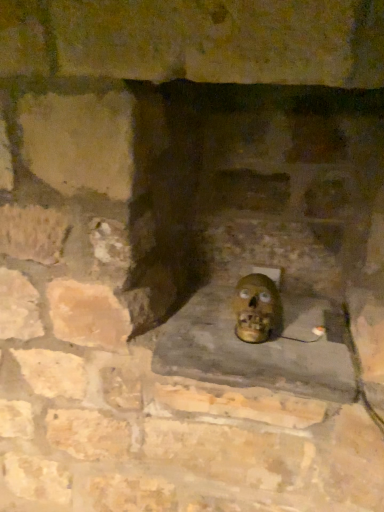
At what (x,y) coordinates should I click in order to perform the action: click on gold metallic skull at center. Please return your answer as a coordinate pair (x, y). Looking at the image, I should click on (257, 309).

The image size is (384, 512). What do you see at coordinates (257, 309) in the screenshot? I see `gold metallic skull at center` at bounding box center [257, 309].

Locate an element on the screen. gold metallic skull at center is located at coordinates (257, 309).